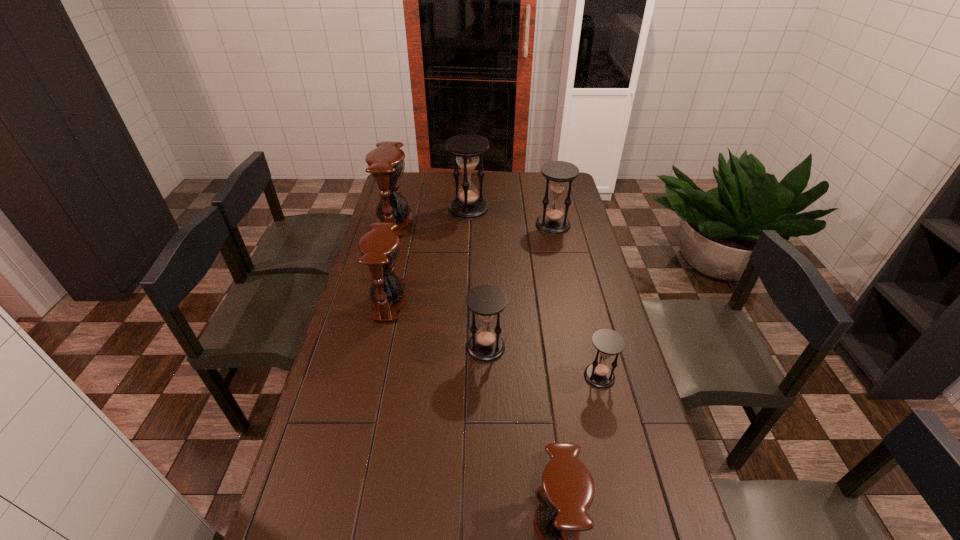
Find the location of a particular element. vacant space located on the right of the farthest brown hourglass is located at coordinates (423, 221).

Find the location of a particular element. Image resolution: width=960 pixels, height=540 pixels. blank area located 0.240m on the front of the third smallest black hourglass is located at coordinates (564, 271).

The width and height of the screenshot is (960, 540). What are the coordinates of `vacant space located 0.190m on the back of the second biggest brown hourglass` in the screenshot? It's located at (400, 250).

Identify the location of vacant area situated 0.130m on the right of the fifth farthest object. The height and width of the screenshot is (540, 960). (545, 347).

Locate an element on the screen. The image size is (960, 540). vacant space located on the back of the shortest object is located at coordinates (579, 292).

I want to click on free space at the far edge, so click(431, 186).

In the image, there is a desktop. Identify the location of free space at the left edge. (374, 349).

This screenshot has height=540, width=960. I want to click on vacant space at the right edge of the desktop, so click(x=677, y=514).

This screenshot has height=540, width=960. Identify the location of free area in between the biggest black hourglass and the fifth farthest object. (477, 278).

The width and height of the screenshot is (960, 540). What are the coordinates of `object that is the second closest to the third nearest hourglass` in the screenshot? It's located at (608, 343).